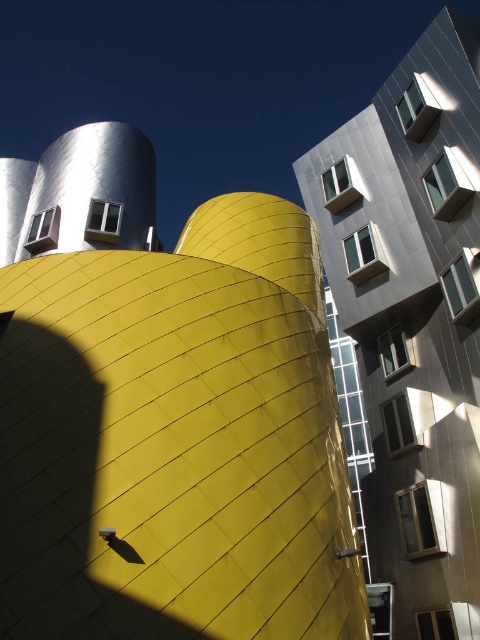
Question: Which of the following is the farthest from the observer?

Choices:
 (A) metallic silver building at upper right
 (B) yellow matte building at center

Answer: (A)

Question: Is yellow matte building at center in front of metallic silver building at upper right?

Choices:
 (A) no
 (B) yes

Answer: (B)

Question: Is yellow matte building at center positioned behind metallic silver building at upper right?

Choices:
 (A) yes
 (B) no

Answer: (B)

Question: Which point is closer to the camera?

Choices:
 (A) metallic silver building at upper right
 (B) yellow matte building at center

Answer: (B)

Question: Where is yellow matte building at center located in relation to metallic silver building at upper right in the image?

Choices:
 (A) left
 (B) right

Answer: (A)

Question: Which object is farther from the camera taking this photo?

Choices:
 (A) metallic silver building at upper right
 (B) yellow matte building at center

Answer: (A)